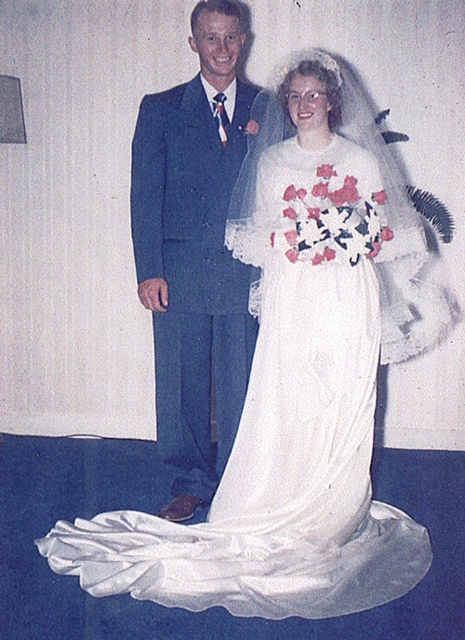
Question: Is white satin dress at center thinner than blue wool suit at center?

Choices:
 (A) yes
 (B) no

Answer: (B)

Question: Is white satin dress at center above blue wool suit at center?

Choices:
 (A) yes
 (B) no

Answer: (B)

Question: Which point is closer to the camera?

Choices:
 (A) (150, 260)
 (B) (338, 316)

Answer: (B)

Question: Is the position of white satin dress at center less distant than that of blue wool suit at center?

Choices:
 (A) no
 (B) yes

Answer: (B)

Question: Among these objects, which one is nearest to the camera?

Choices:
 (A) white satin dress at center
 (B) blue wool suit at center

Answer: (A)